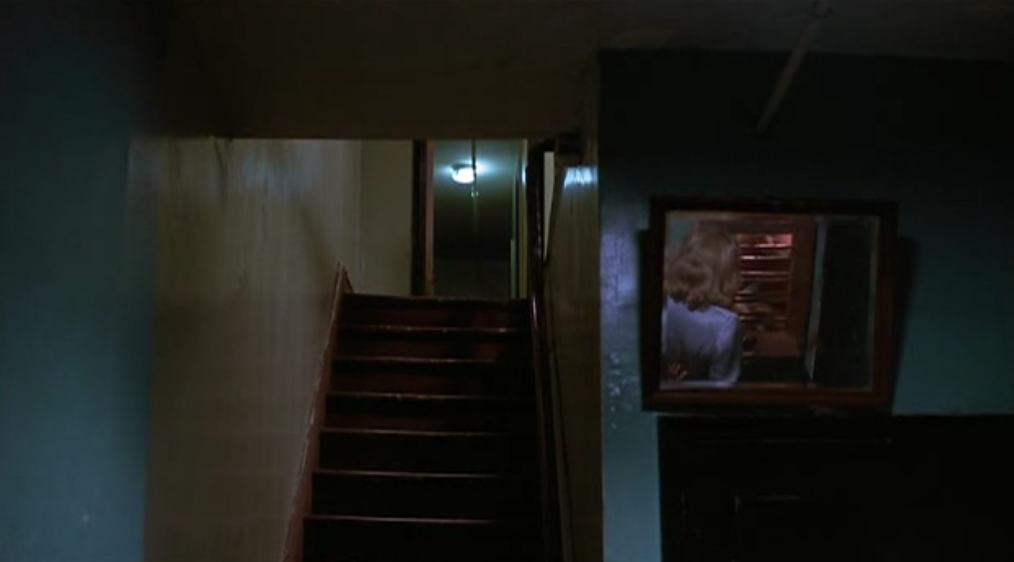
Image resolution: width=1014 pixels, height=562 pixels. Find the location of `paint bubble`. paint bubble is located at coordinates (623, 369), (618, 398).